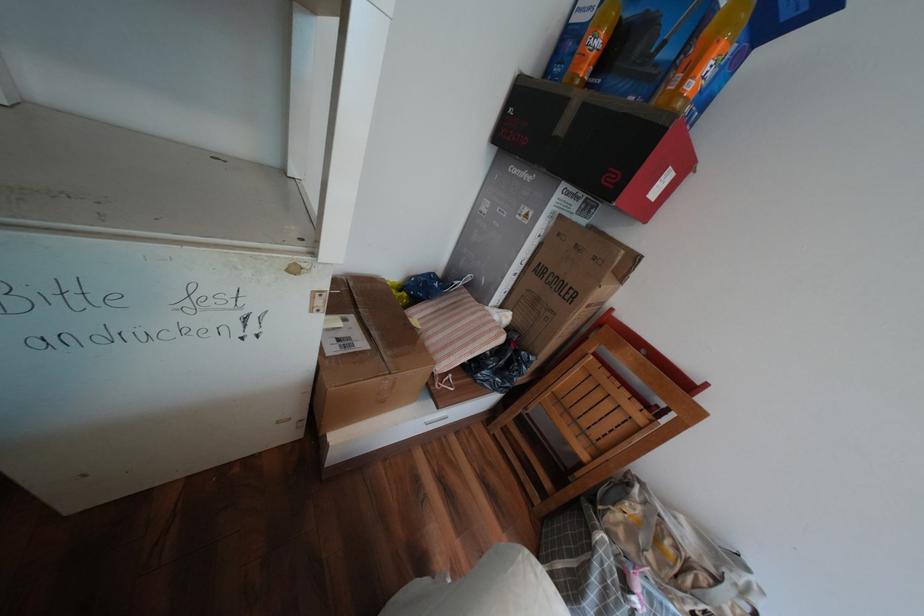
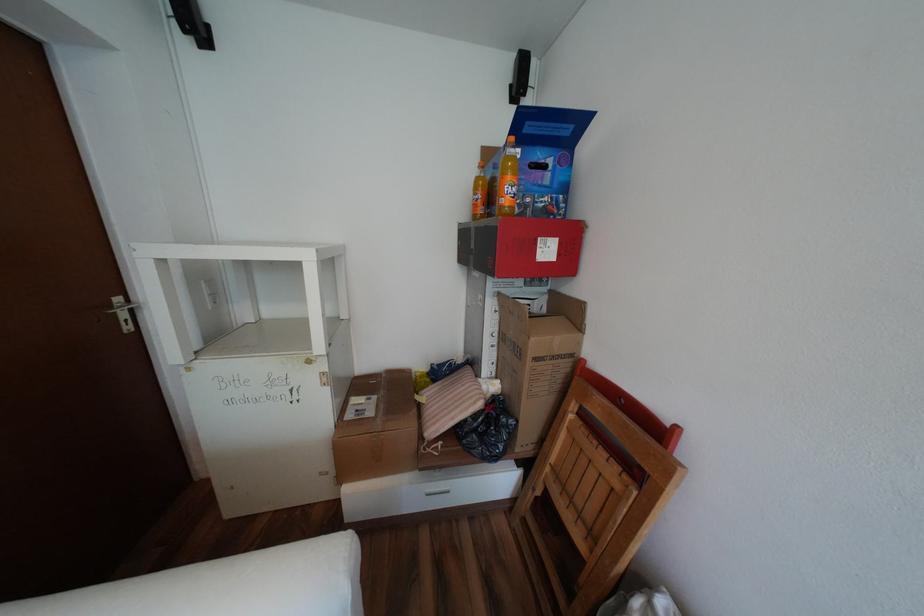
The point at (703, 78) is marked in the first image. Where is the corresponding point in the second image?

(512, 197)